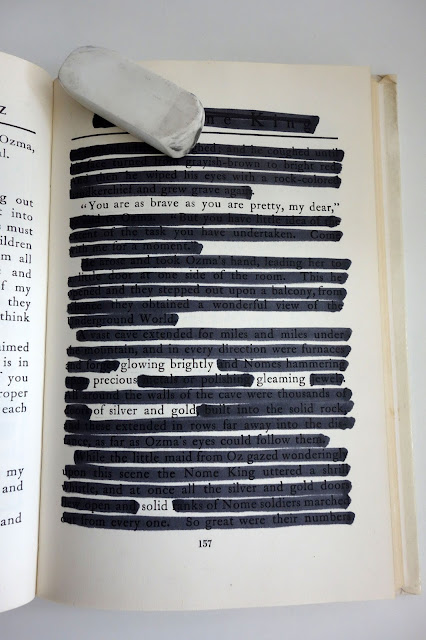
Where is `top right corner of book`? The image size is (426, 640). top right corner of book is located at coordinates (394, 77).